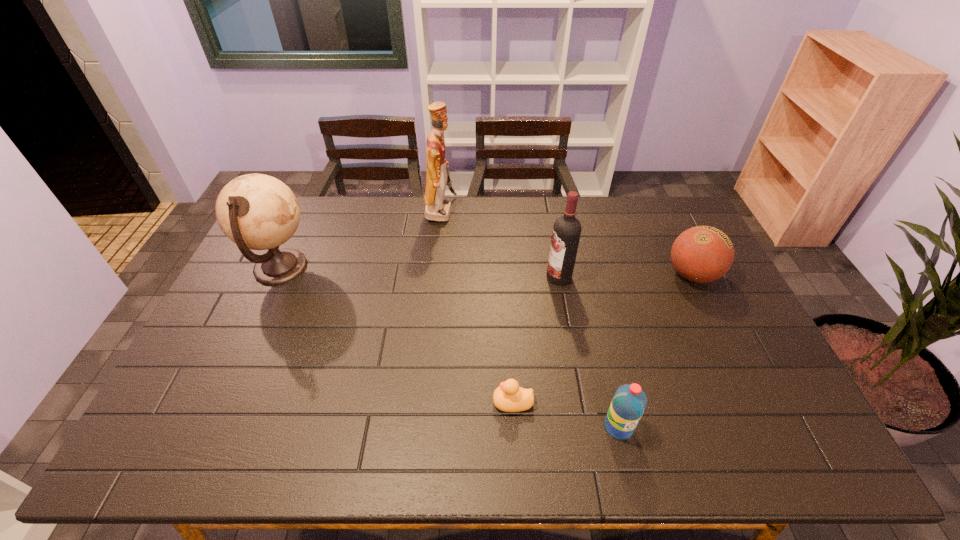
The height and width of the screenshot is (540, 960). In order to click on object that is positioned at the right edge in this screenshot , I will do `click(702, 254)`.

This screenshot has height=540, width=960. Identify the location of vacant region at the far edge of the desktop. (504, 203).

In the image, there is a desktop. Where is `free region at the near edge`? free region at the near edge is located at coordinates (401, 444).

Find the location of a particular element. This screenshot has width=960, height=540. vacant region at the left edge of the desktop is located at coordinates (206, 338).

Find the location of a particular element. This screenshot has width=960, height=540. free space at the right edge is located at coordinates (683, 286).

Where is `free region at the far right corner of the desktop`? Image resolution: width=960 pixels, height=540 pixels. free region at the far right corner of the desktop is located at coordinates (681, 208).

Locate an element on the screen. vacant area that lies between the globe and the basketball is located at coordinates (487, 272).

Locate an element on the screen. The width and height of the screenshot is (960, 540). blank region between the fourth object from left to right and the globe is located at coordinates (420, 273).

The width and height of the screenshot is (960, 540). Find the location of `vacant area that lies between the second object from left to right and the leftmost object`. vacant area that lies between the second object from left to right and the leftmost object is located at coordinates (x=361, y=240).

Where is `vacant space in between the water bottle and the fourth object from left to right`? vacant space in between the water bottle and the fourth object from left to right is located at coordinates (588, 352).